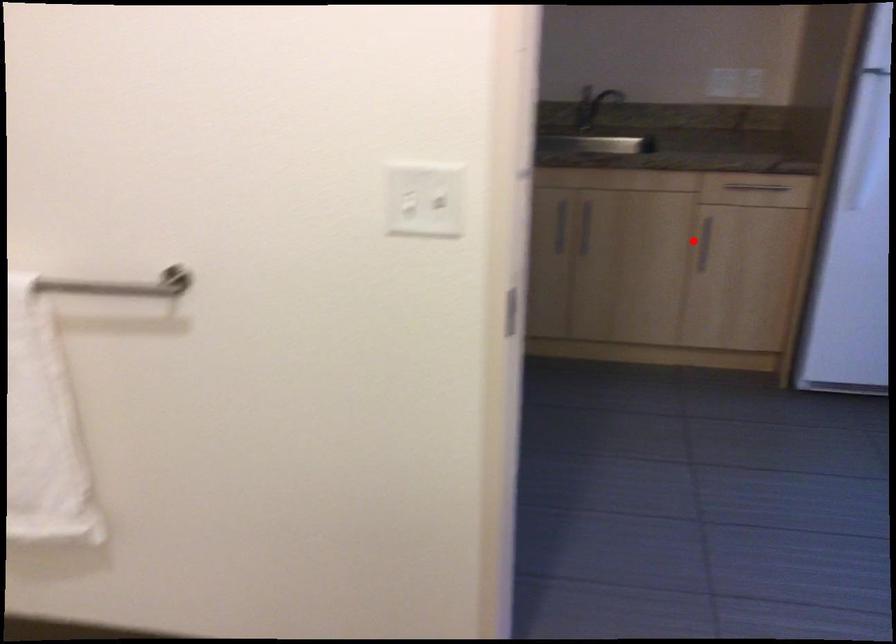
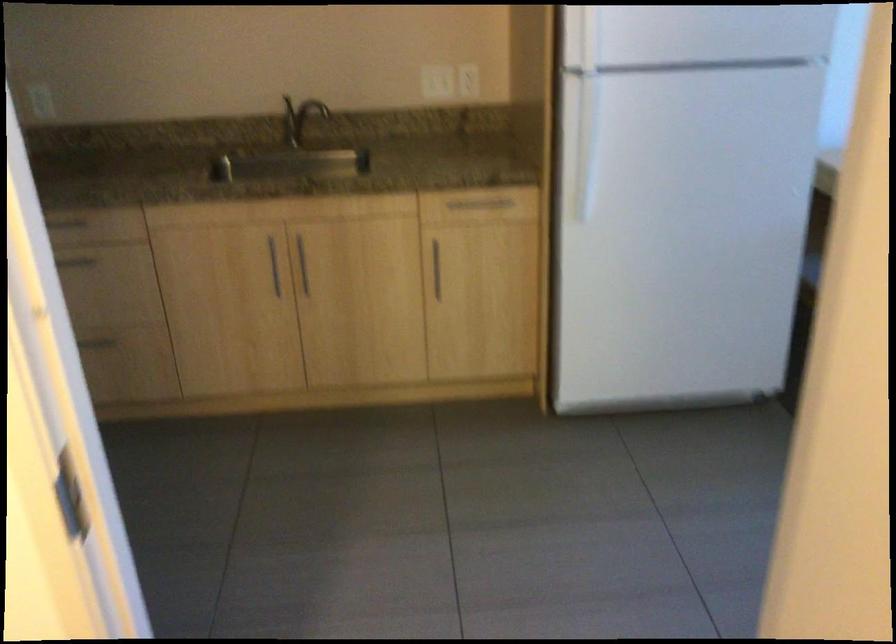
The point at the highlighted location is marked in the first image. Where is the corresponding point in the second image?

(435, 269)